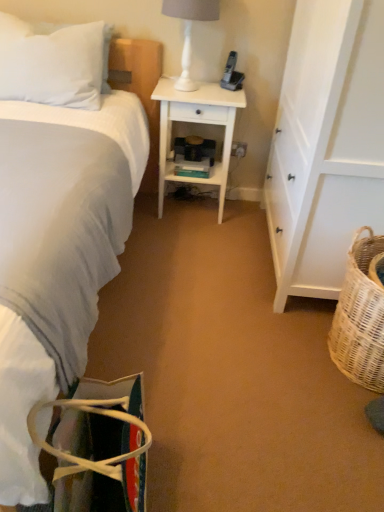
This screenshot has width=384, height=512. I want to click on empty space that is ontop of white wood desk at center (from a real-world perspective), so click(201, 91).